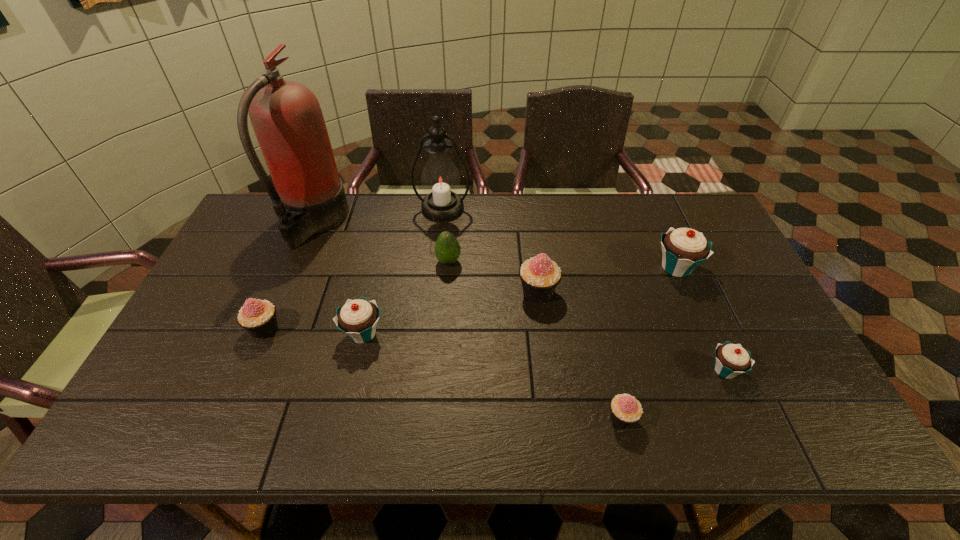
I want to click on pink cupcake that can be found as the third closest to the fire extinguisher, so click(626, 410).

Identify the location of teal cupcake that is the closest one to the seventh object from right to left. This screenshot has width=960, height=540. (683, 249).

Locate an element on the screen. teal cupcake that is the closest to the third object from left to right is located at coordinates (683, 249).

Where is `free space that satisfies the following two spatial constraints: 1. at the nozzle of the avocado; 2. on the right side of the tallest object`? The height and width of the screenshot is (540, 960). free space that satisfies the following two spatial constraints: 1. at the nozzle of the avocado; 2. on the right side of the tallest object is located at coordinates (299, 261).

I want to click on vacant area that satisfies the following two spatial constraints: 1. at the nozzle of the fire extinguisher; 2. on the right side of the green avocado, so click(299, 261).

Find the location of a particular element. vacant space that satisfies the following two spatial constraints: 1. at the nozzle of the tallest object; 2. on the right side of the smallest teal cupcake is located at coordinates (254, 370).